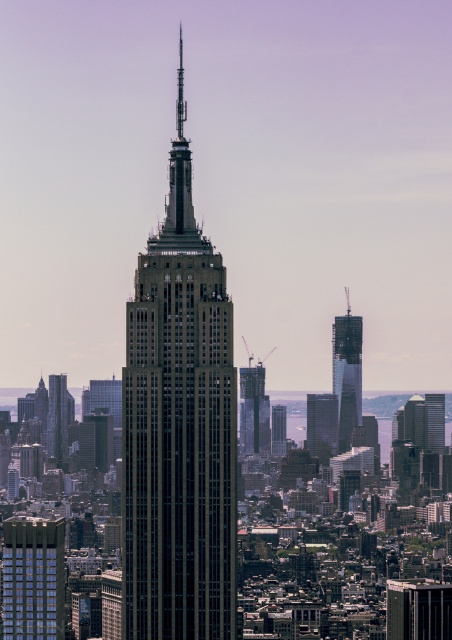
Question: Considering the real-world distances, which object is farthest from the dark gray glass skyscraper at center?

Choices:
 (A) glassy reflective skyscraper at right
 (B) dark gray stone skyscraper at center
 (C) glassy reflective skyscraper at center

Answer: (A)

Question: Can you confirm if metallic glass skyscraper at center is smaller than glassy reflective skyscraper at right?

Choices:
 (A) yes
 (B) no

Answer: (B)

Question: Is blue glass skyscraper at lower left further to the viewer compared to glassy steel skyscraper at center?

Choices:
 (A) no
 (B) yes

Answer: (B)

Question: Which object appears farthest from the camera in this image?

Choices:
 (A) metallic glass skyscraper at center
 (B) glassy reflective skyscraper at right
 (C) dark gray glass skyscraper at center

Answer: (A)

Question: Which object appears closest to the camera in this image?

Choices:
 (A) glassy reflective skyscraper at right
 (B) glassy reflective skyscraper at center
 (C) blue glass skyscraper at lower left

Answer: (A)

Question: Does metallic glass skyscraper at center appear under glassy reflective skyscraper at right?

Choices:
 (A) no
 (B) yes

Answer: (B)